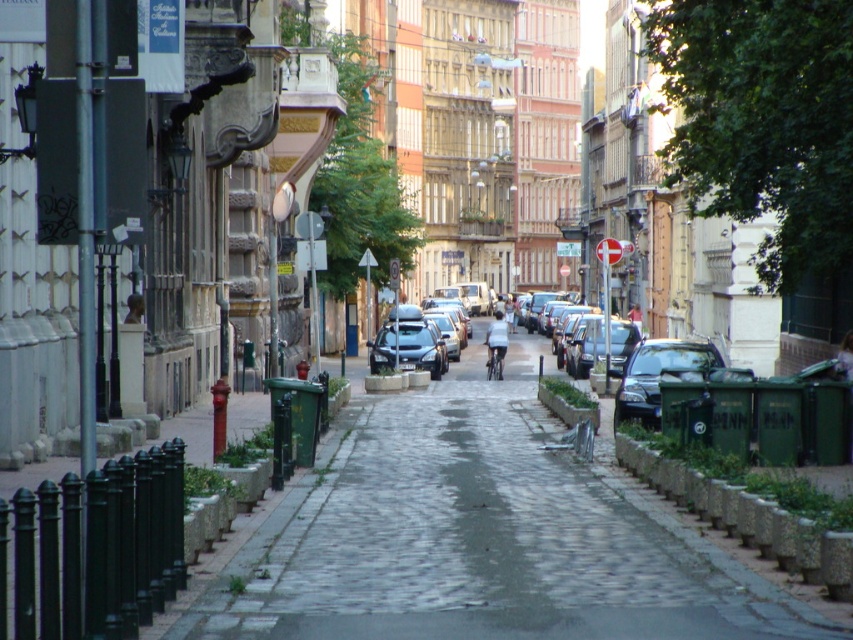
You are a delivery person trying to navigate through the narrow cobblestone street. You see the metallic dark green car at right and the light blue fabric shirt at center. Which object is taller?

The light blue fabric shirt at center is taller than the metallic dark green car at right.

You are standing at the entrance of the street and want to walk to the cobblestone pavement at center. Which direction should you move relative to the parked cars on the right side?

The cobblestone pavement at center is located at point (480,541), which is in the middle of the street. Since the parked cars are on the right side, you should move towards the left side of the street to reach the cobblestone pavement at center.

You are a delivery person trying to park your van in this narrow street. You see a satin black car at center and a shiny black sedan at center. Which vehicle should you move first to make space for your van?

The satin black car at center is closer to you than the shiny black sedan at center, so you should move the satin black car at center first to create space for your van.